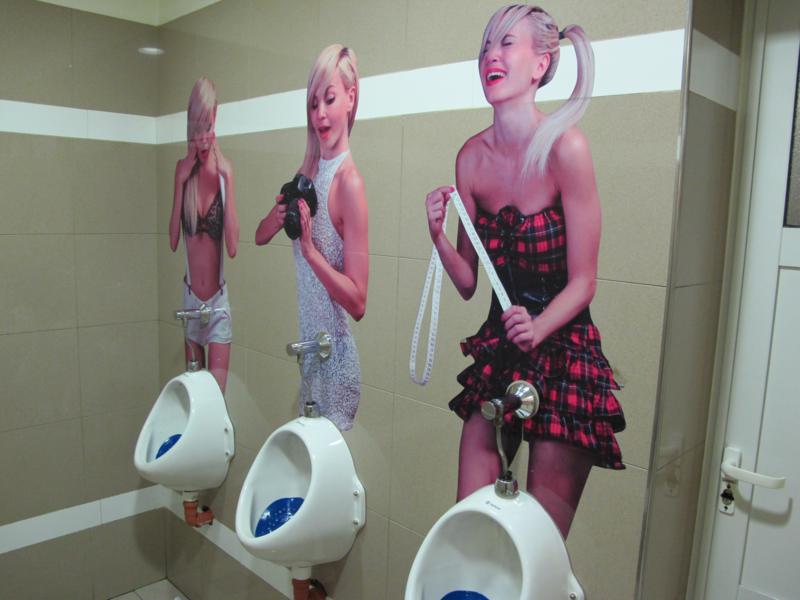
Locate an element on the screen. wall is located at coordinates (394, 194).